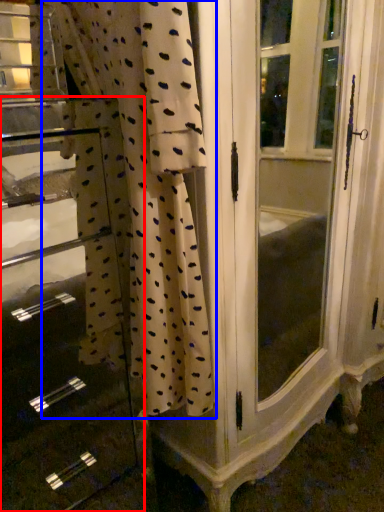
Question: Which object is closer to the camera taking this photo, file cabinet (highlighted by a red box) or curtain (highlighted by a blue box)?

Choices:
 (A) file cabinet
 (B) curtain

Answer: (B)